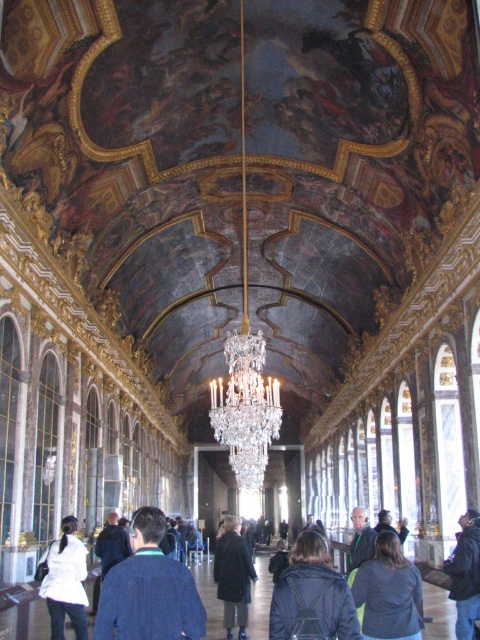
You are an architect inspecting the ceiling of this ornate hall. You notice two points marked on the ceiling at coordinates point (120, 616) and point (240, 348). Based on your spatial analysis, which point is positioned closer to your viewpoint?

Point (120, 616) is closer to the viewer than point (240, 348) according to the description.

You are standing in the grand hall and notice two items at the center area. Which one is located to the left when facing the clear crystal chandelier at center and dark blue jacket at center?

The clear crystal chandelier at center is positioned on the left side of the dark blue jacket at center, so when facing them, the clear crystal chandelier at center is to the left.

You are standing in the grand hall and want to locate two specific points on the ceiling. The first point is at coordinate point (305, 570) and the second is at point (472, 572). Which point is closer to you when viewed from your current position?

Point (305, 570) is in front of point (472, 572), so it is closer to you.